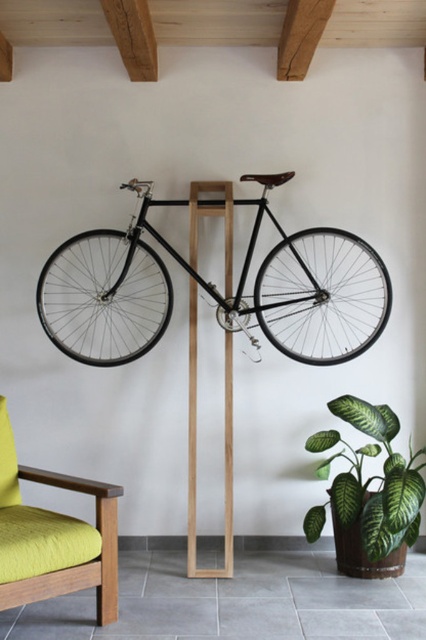
You are an interior designer planning to place a new rectangular table between the green matte leafy plant at lower right and the wooden beam at center. The table is 1.2 meters wide. Can the table fit between them without touching either object?

The green matte leafy plant at lower right might be wider than the wooden beam at center, so the space between them is uncertain. Therefore, the table might not fit safely between them without risking contact with either object.

You are standing in the room and want to place a new painting on the wall between the green matte leafy plant at lower right and the wooden beam at center. Can you fit it there?

The green matte leafy plant at lower right is to the right of the wooden beam at center, so there is space between them to place the painting.